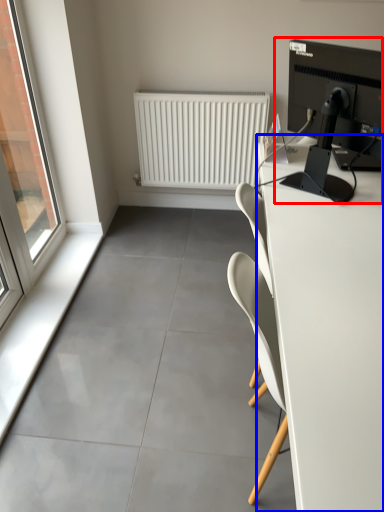
Question: Which of the following is the farthest to the observer, desktop computer (highlighted by a red box) or desk (highlighted by a blue box)?

Choices:
 (A) desktop computer
 (B) desk

Answer: (A)